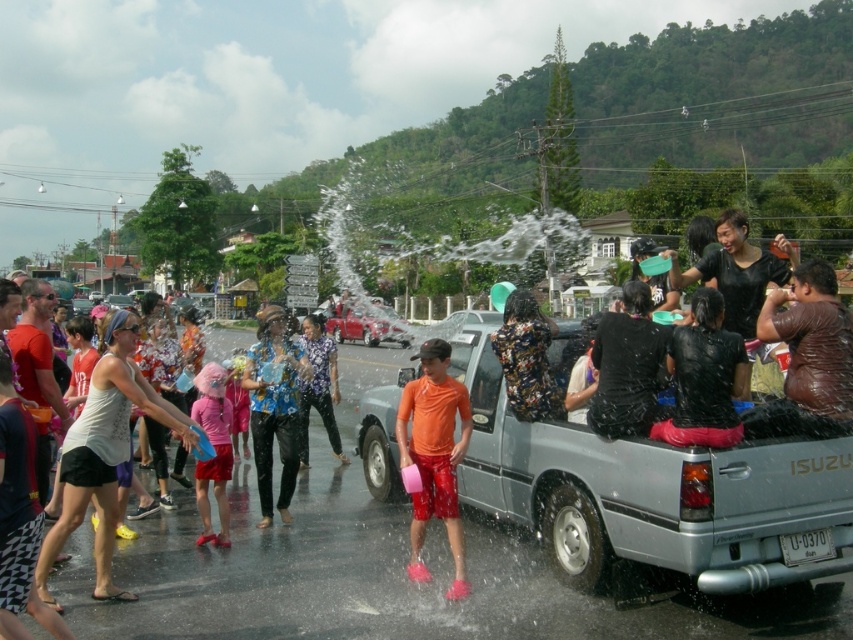
You are a photographer standing on the road and want to capture both the silver metallic truck at center and the white cotton tank top at center in the same frame. Which object should you focus on first to ensure both are in the frame?

The silver metallic truck at center is below the white cotton tank top at center, so you should focus on the white cotton tank top at center first to ensure both are in the frame.

You are a photographer standing at the camera position. You want to capture a closeup of the white cotton tank top at center. Can you estimate if it is within the typical 5 meter focus range of your camera lens?

The white cotton tank top at center is 4.98 meters from camera, so it is within the typical 5 meter focus range of your camera lens.